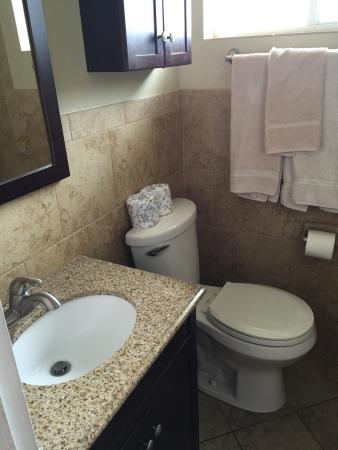
Where is `floor`? floor is located at coordinates (263, 446).